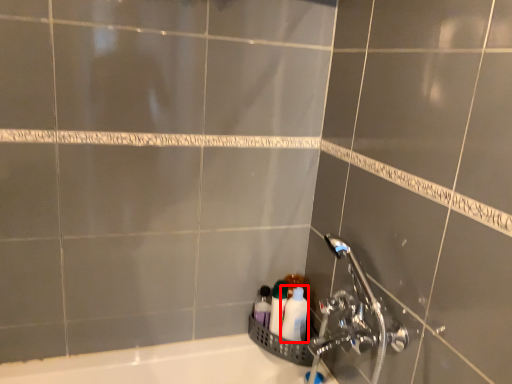
Question: From the image's perspective, considering the relative positions of toiletry (annotated by the red box) and toiletry in the image provided, where is toiletry (annotated by the red box) located with respect to the staircase?

Choices:
 (A) below
 (B) above

Answer: (A)